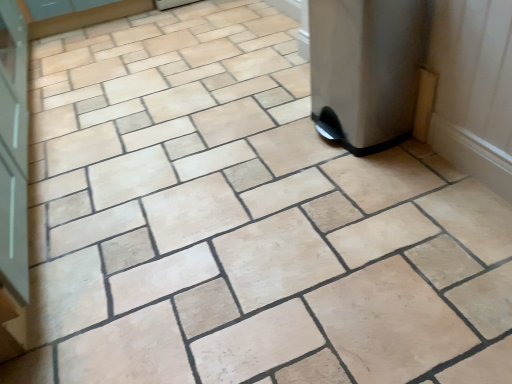
In order to click on vacant area that is in front of metallic trash can at right in this screenshot , I will do `click(378, 187)`.